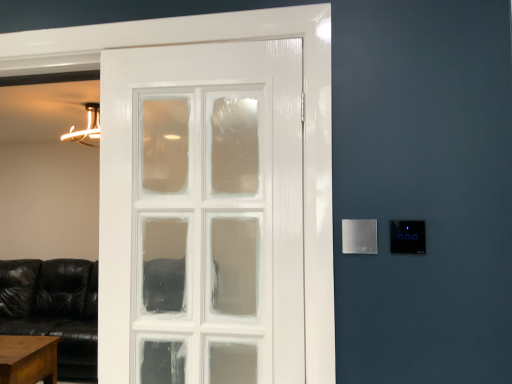
Question: Could you tell me if satin silver panel at right, which is the 1th light switch in right-to-left order, is turned towards satin silver panel at right, marked as the 2th light switch in a right-to-left arrangement?

Choices:
 (A) yes
 (B) no

Answer: (B)

Question: Can you confirm if satin silver panel at right, arranged as the 2th light switch when viewed from the left, is bigger than satin silver panel at right, marked as the 2th light switch in a right-to-left arrangement?

Choices:
 (A) no
 (B) yes

Answer: (A)

Question: Is satin silver panel at right, marked as the 2th light switch in a right-to-left arrangement, inside satin silver panel at right, arranged as the 2th light switch when viewed from the left?

Choices:
 (A) yes
 (B) no

Answer: (B)

Question: Is satin silver panel at right, the 1th light switch from the left, at the back of satin silver panel at right, arranged as the 2th light switch when viewed from the left?

Choices:
 (A) yes
 (B) no

Answer: (B)

Question: Is satin silver panel at right, arranged as the 2th light switch when viewed from the left, taller than satin silver panel at right, marked as the 2th light switch in a right-to-left arrangement?

Choices:
 (A) yes
 (B) no

Answer: (B)

Question: From the image's perspective, is brown wooden table at lower left located above or below satin silver panel at right, marked as the 2th light switch in a right-to-left arrangement?

Choices:
 (A) above
 (B) below

Answer: (B)

Question: Is brown wooden table at lower left bigger or smaller than satin silver panel at right, marked as the 2th light switch in a right-to-left arrangement?

Choices:
 (A) big
 (B) small

Answer: (A)

Question: Is brown wooden table at lower left spatially inside satin silver panel at right, the 1th light switch from the left, or outside of it?

Choices:
 (A) inside
 (B) outside

Answer: (B)

Question: From a real-world perspective, is brown wooden table at lower left above or below satin silver panel at right, the 1th light switch from the left?

Choices:
 (A) above
 (B) below

Answer: (B)

Question: Is satin silver panel at right, marked as the 2th light switch in a right-to-left arrangement, in front of or behind satin silver panel at right, arranged as the 2th light switch when viewed from the left, in the image?

Choices:
 (A) behind
 (B) front

Answer: (A)

Question: From a real-world perspective, is satin silver panel at right, the 1th light switch from the left, positioned above or below satin silver panel at right, arranged as the 2th light switch when viewed from the left?

Choices:
 (A) below
 (B) above

Answer: (A)

Question: Is satin silver panel at right, the 1th light switch from the left, taller or shorter than satin silver panel at right, which is the 1th light switch in right-to-left order?

Choices:
 (A) tall
 (B) short

Answer: (A)

Question: Is satin silver panel at right, the 1th light switch from the left, inside or outside of satin silver panel at right, arranged as the 2th light switch when viewed from the left?

Choices:
 (A) outside
 (B) inside

Answer: (A)

Question: Is brown wooden table at lower left to the left or to the right of satin silver panel at right, arranged as the 2th light switch when viewed from the left, in the image?

Choices:
 (A) right
 (B) left

Answer: (B)

Question: Is brown wooden table at lower left bigger or smaller than satin silver panel at right, which is the 1th light switch in right-to-left order?

Choices:
 (A) big
 (B) small

Answer: (A)